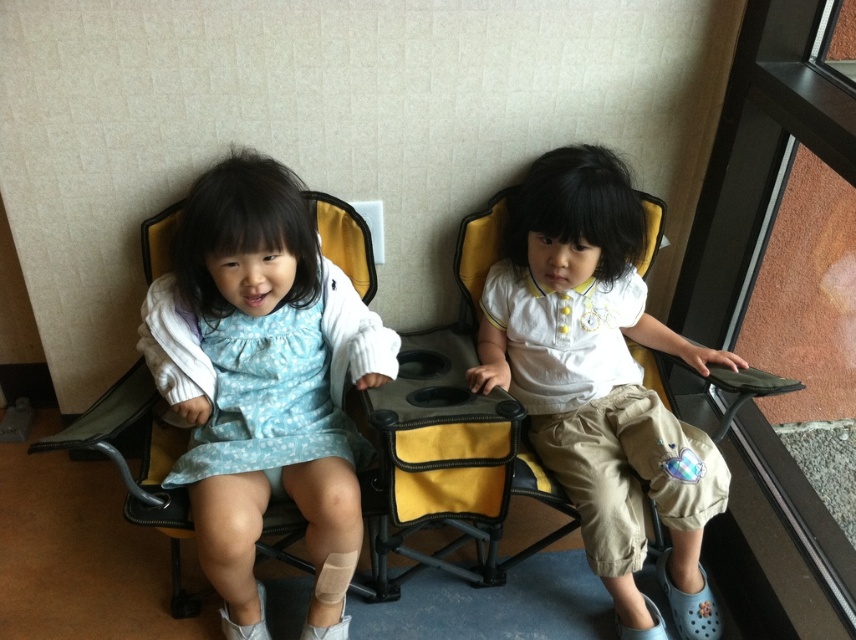
Who is positioned more to the left, matte blue dress at center or white cotton shirt at center?

Positioned to the left is matte blue dress at center.

Locate an element on the screen. This screenshot has width=856, height=640. matte blue dress at center is located at coordinates (263, 381).

This screenshot has width=856, height=640. I want to click on matte blue dress at center, so click(263, 381).